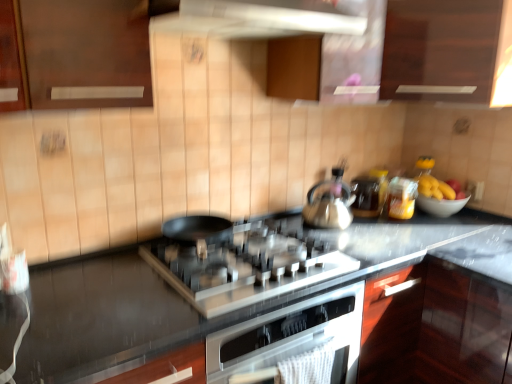
The height and width of the screenshot is (384, 512). Identify the location of free spot to the right of satin silver kettle at center. (378, 227).